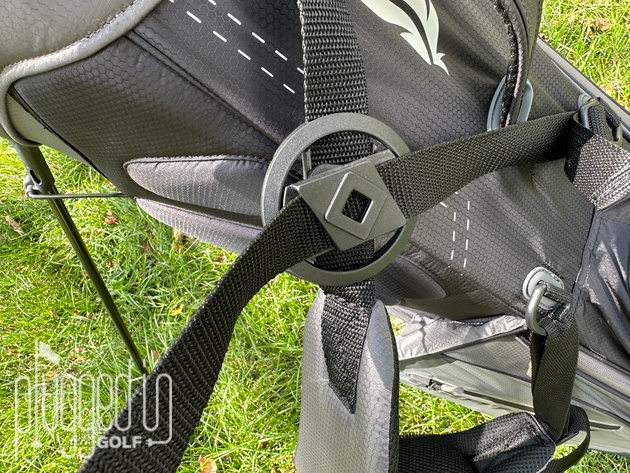
The height and width of the screenshot is (473, 630). I want to click on decorative piping, so click(101, 36), click(596, 354), click(595, 379).